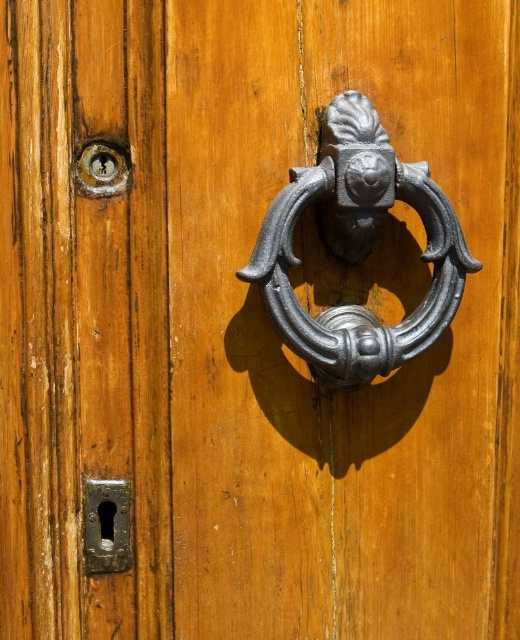
You are standing in front of the wooden door with the decorative metal knocker. You need to reach a point that is exactly 3.51 feet away from where you are standing. Can you determine if the point at coordinates point (274,296) is exactly at that distance?

The point (274,296) is 3.51 feet away from the camera, so yes, the point at coordinates point (274,296) is exactly at that distance of 3.51 feet.

You are standing in front of the wooden door and want to locate the polished silver knocker at center. Based on the coordinates provided, where should you look to find it?

The polished silver knocker at center is located at coordinates point (x=357, y=248).